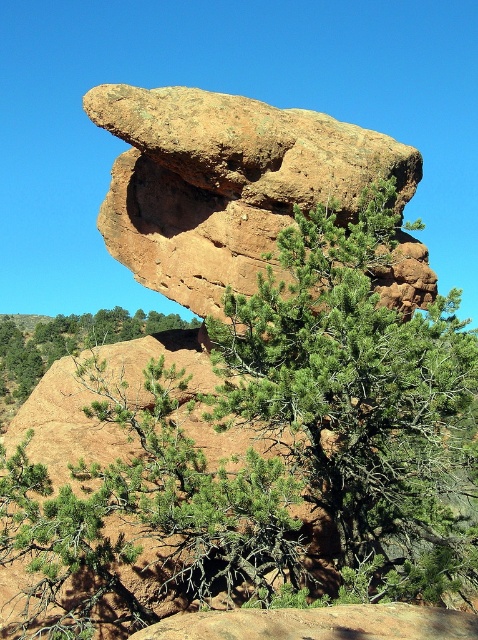
Where is `green needle-like tree at center`? The width and height of the screenshot is (478, 640). green needle-like tree at center is located at coordinates (361, 397).

Measure the distance between point (371, 433) and camera.

11.83 meters

You are a GUI agent. You are given a task and a screenshot of the screen. Output one action in this format:
    pyautogui.click(x=<x>, y=<y>)
    Task: Click on the green needle-like tree at center
    
    Given the screenshot: What is the action you would take?
    pyautogui.click(x=361, y=397)